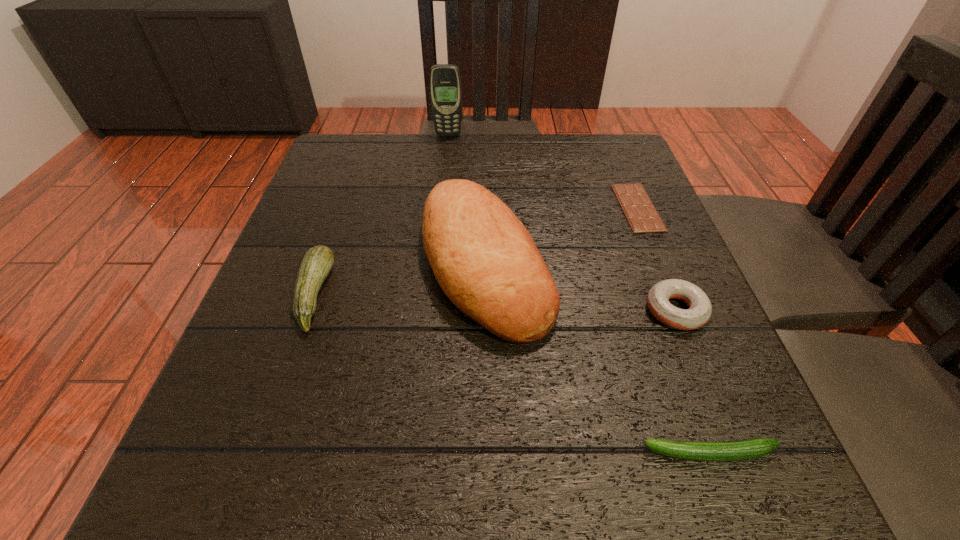
Identify the location of vacant space at the far left corner. coord(332,144).

This screenshot has width=960, height=540. In the image, there is a desktop. Identify the location of vacant space at the near right corner. (727, 511).

Where is `free space between the shortest object and the doughnut`? The image size is (960, 540). free space between the shortest object and the doughnut is located at coordinates (657, 259).

The height and width of the screenshot is (540, 960). I want to click on free area in between the bread and the right zucchini, so click(597, 358).

Image resolution: width=960 pixels, height=540 pixels. Identify the location of unoccupied area between the right zucchini and the fifth shortest object. (597, 358).

The width and height of the screenshot is (960, 540). Find the location of `free spot between the shortest object and the tallest object`. free spot between the shortest object and the tallest object is located at coordinates (543, 171).

Image resolution: width=960 pixels, height=540 pixels. I want to click on free space between the cellular telephone and the fourth shortest object, so click(x=381, y=215).

This screenshot has width=960, height=540. In order to click on vacant point located between the third tallest object and the tallest object in this screenshot , I will do `click(381, 215)`.

Where is `free spot between the doughnut and the farthest object`? The image size is (960, 540). free spot between the doughnut and the farthest object is located at coordinates (562, 222).

At what (x,y) coordinates should I click in order to perform the action: click on vacant space that's between the chocolate bar and the doughnut. Please return your answer as a coordinate pair (x, y). Looking at the image, I should click on (657, 259).